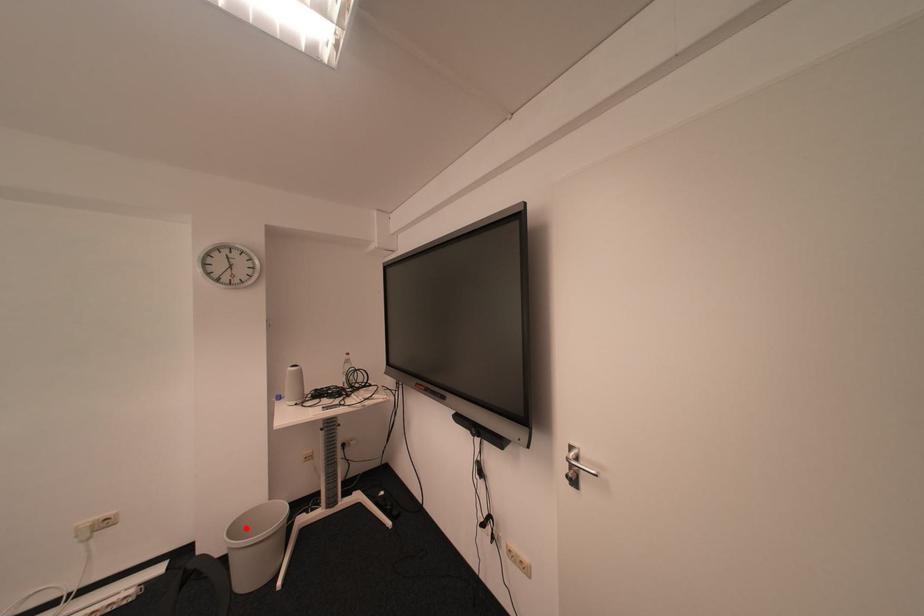
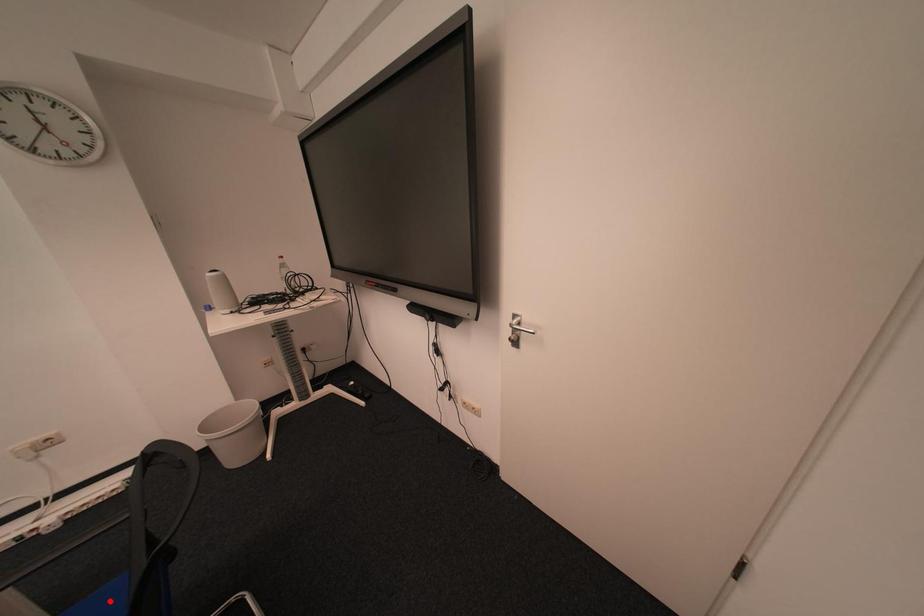
I am providing you with two images of the same scene from different viewpoints. A red point is marked on the first image and another point is marked on the second image. Does the point marked in image1 correspond to the same location as the one in image2?

No